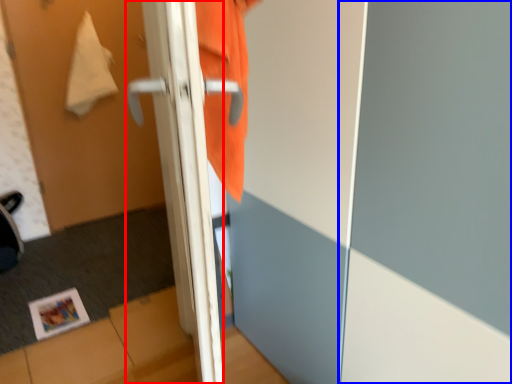
Question: Among these objects, which one is farthest to the camera, door (highlighted by a red box) or screen door (highlighted by a blue box)?

Choices:
 (A) door
 (B) screen door

Answer: (B)